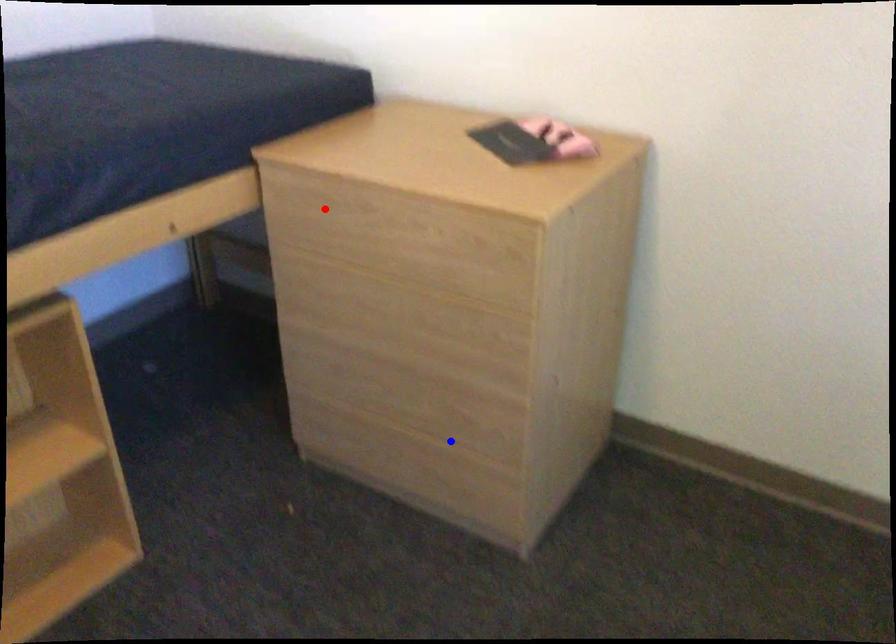
Question: In the image, two points are highlighted. Which point is nearer to the camera? Reply with the corresponding letter.

Choices:
 (A) blue point
 (B) red point

Answer: (B)